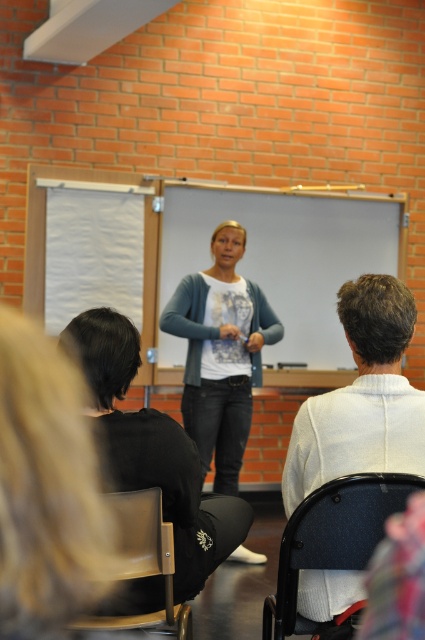
Question: Is white sweater at center below black fabric pants at lower left?

Choices:
 (A) yes
 (B) no

Answer: (B)

Question: Among these objects, which one is nearest to the camera?

Choices:
 (A) black fabric pants at lower left
 (B) white sweater at center
 (C) matte blue cardigan at center

Answer: (B)

Question: Is white sweater at center further to camera compared to matte blue cardigan at center?

Choices:
 (A) no
 (B) yes

Answer: (A)

Question: Based on their relative distances, which object is farther from the black fabric pants at lower left?

Choices:
 (A) white sweater at center
 (B) matte blue cardigan at center

Answer: (B)

Question: Where is white sweater at center located in relation to black fabric pants at lower left in the image?

Choices:
 (A) above
 (B) below

Answer: (A)

Question: Which is farther from the black fabric pants at lower left?

Choices:
 (A) matte blue cardigan at center
 (B) white sweater at center

Answer: (A)